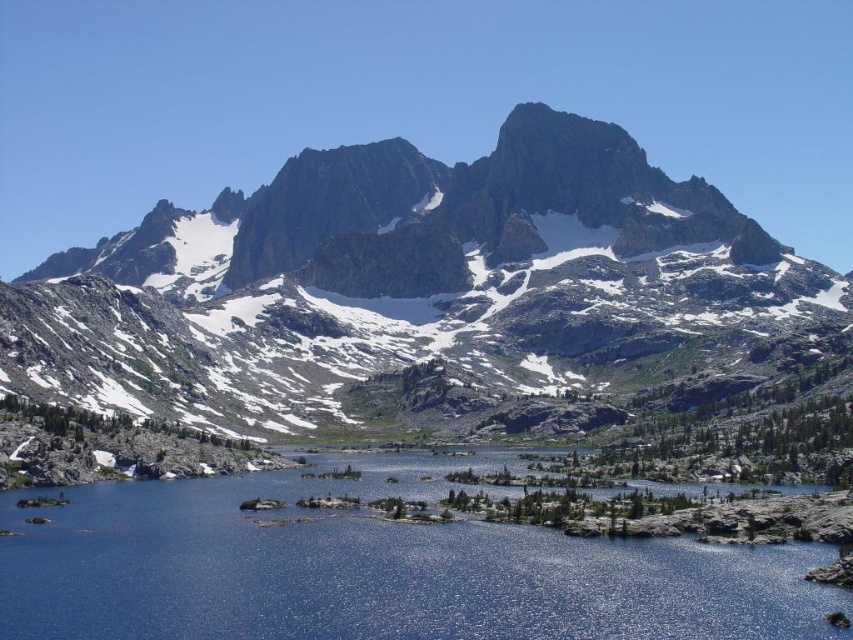
You are standing at the edge of the lake and want to take a photo of both the rocky gray mountain range at upper center and the blue reflective water at center. Which object should you position to the left side of your camera frame to include both in the shot?

You should position the rocky gray mountain range at upper center to the left side of your camera frame since it is already to the left of the blue reflective water at center.

You are a hiker standing at the base of the rocky gray mountain range at upper center and looking towards the blue reflective water at center. Which object is higher in elevation?

The rocky gray mountain range at upper center is taller than the blue reflective water at center, so the rocky gray mountain range at upper center is higher in elevation.

You are a photographer planning to capture the rocky gray mountain range at upper center and the blue reflective water at center in a single shot. Which object will occupy more of the frame in your photograph?

The rocky gray mountain range at upper center will occupy more of the frame in your photograph since it has a larger size compared to the blue reflective water at center.